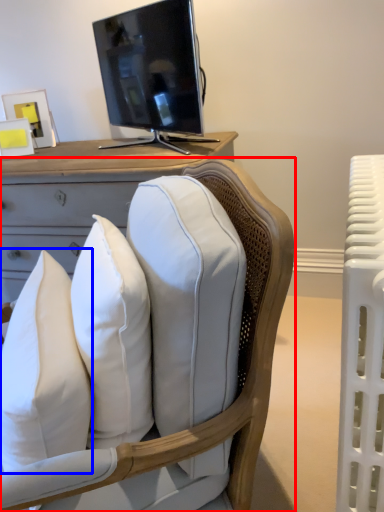
Question: Which object is further to the camera taking this photo, chair (highlighted by a red box) or pillow (highlighted by a blue box)?

Choices:
 (A) chair
 (B) pillow

Answer: (B)